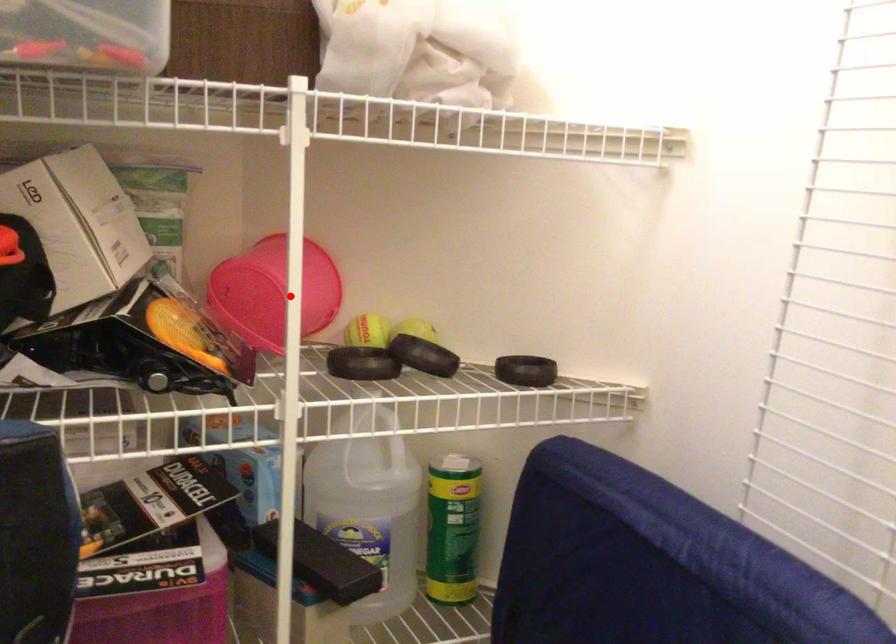
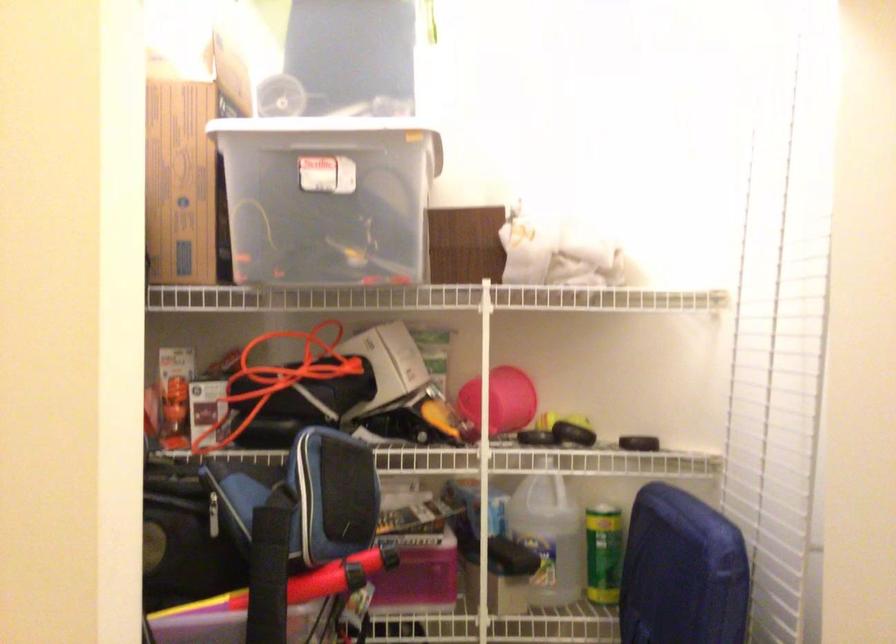
Where in the second image is the point corresponding to the highlighted location from the first image?

(500, 401)